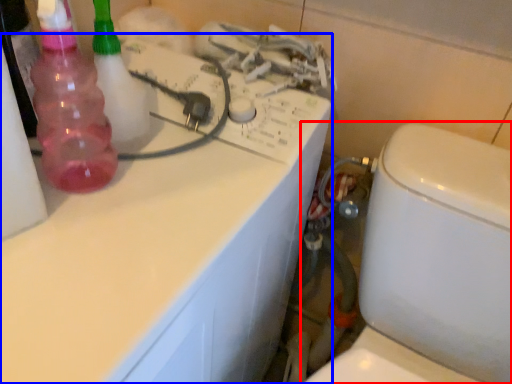
Question: Which of the following is the closest to the observer, toilet (highlighted by a red box) or counter top (highlighted by a blue box)?

Choices:
 (A) toilet
 (B) counter top

Answer: (A)